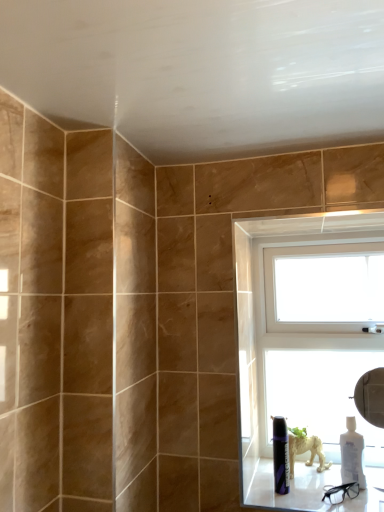
This screenshot has width=384, height=512. Identify the location of empty space that is ontop of white glossy window sill at lower right (from a real-world perspective). (316, 485).